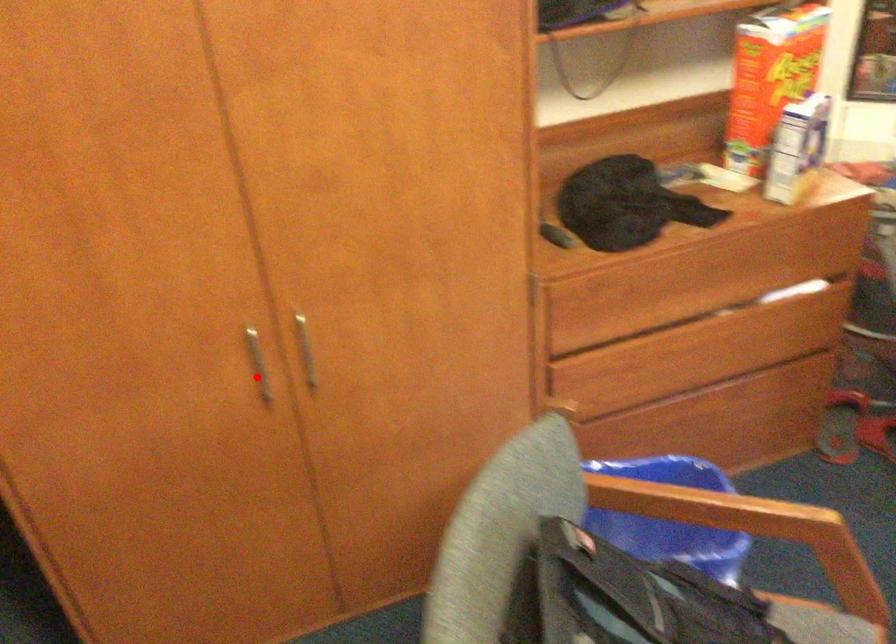
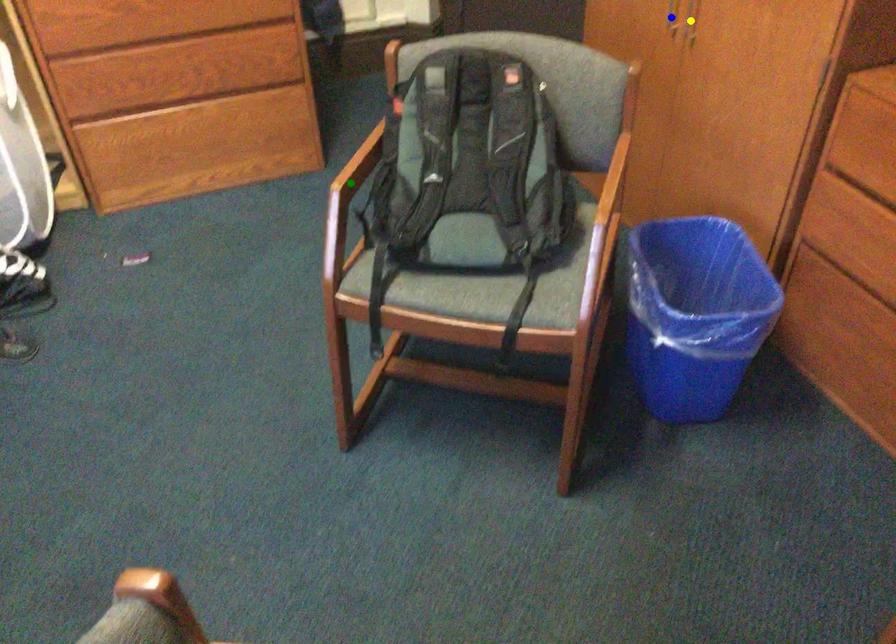
Question: I am providing you with two images of the same scene from different viewpoints. A red point is marked on the first image. You are given multiple points on the second image. Which spot in image 2 lines up with the point in image 1?

Choices:
 (A) blue point
 (B) yellow point
 (C) green point

Answer: (A)